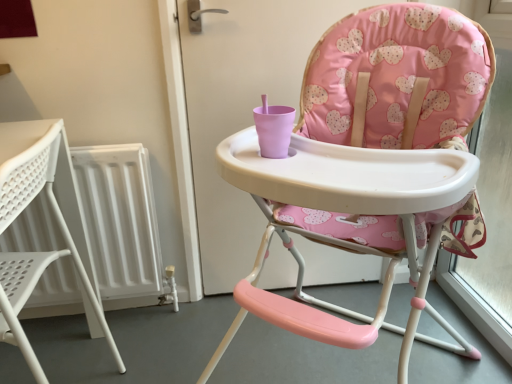
Question: Which direction should I rotate to look at pink fabric highchair at center, the first chair when ordered from right to left?

Choices:
 (A) right
 (B) left

Answer: (A)

Question: Is white plastic chair at left, which ranks as the first chair in left-to-right order, shorter than pink fabric highchair at center, placed as the 2th chair when sorted from left to right?

Choices:
 (A) yes
 (B) no

Answer: (A)

Question: Does white plastic chair at left, the second chair in the right-to-left sequence, appear on the right side of pink fabric highchair at center, the first chair when ordered from right to left?

Choices:
 (A) no
 (B) yes

Answer: (A)

Question: Does white plastic chair at left, which ranks as the first chair in left-to-right order, contain pink fabric highchair at center, placed as the 2th chair when sorted from left to right?

Choices:
 (A) yes
 (B) no

Answer: (B)

Question: From a real-world perspective, is white plastic chair at left, which ranks as the first chair in left-to-right order, physically below pink fabric highchair at center, placed as the 2th chair when sorted from left to right?

Choices:
 (A) yes
 (B) no

Answer: (A)

Question: Does white plastic chair at left, which ranks as the first chair in left-to-right order, have a greater width compared to pink fabric highchair at center, the first chair when ordered from right to left?

Choices:
 (A) yes
 (B) no

Answer: (B)

Question: From a real-world perspective, is white plastic chair at left, which ranks as the first chair in left-to-right order, positioned over pink fabric highchair at center, the first chair when ordered from right to left, based on gravity?

Choices:
 (A) no
 (B) yes

Answer: (A)

Question: Is pink fabric highchair at center, placed as the 2th chair when sorted from left to right, further to camera compared to white plastic chair at left, the second chair in the right-to-left sequence?

Choices:
 (A) yes
 (B) no

Answer: (B)

Question: From a real-world perspective, is pink fabric highchair at center, placed as the 2th chair when sorted from left to right, beneath white plastic chair at left, the second chair in the right-to-left sequence?

Choices:
 (A) yes
 (B) no

Answer: (B)

Question: From a real-world perspective, is pink fabric highchair at center, the first chair when ordered from right to left, over white plastic chair at left, the second chair in the right-to-left sequence?

Choices:
 (A) yes
 (B) no

Answer: (A)

Question: Is pink fabric highchair at center, the first chair when ordered from right to left, bigger than white plastic chair at left, which ranks as the first chair in left-to-right order?

Choices:
 (A) yes
 (B) no

Answer: (A)

Question: From the image's perspective, is pink fabric highchair at center, the first chair when ordered from right to left, located above white plastic chair at left, the second chair in the right-to-left sequence?

Choices:
 (A) yes
 (B) no

Answer: (A)

Question: Can you confirm if pink fabric highchair at center, placed as the 2th chair when sorted from left to right, is thinner than white plastic chair at left, which ranks as the first chair in left-to-right order?

Choices:
 (A) no
 (B) yes

Answer: (A)

Question: Relative to pink fabric highchair at center, the first chair when ordered from right to left, is white plastic chair at left, the second chair in the right-to-left sequence, in front or behind?

Choices:
 (A) front
 (B) behind

Answer: (B)